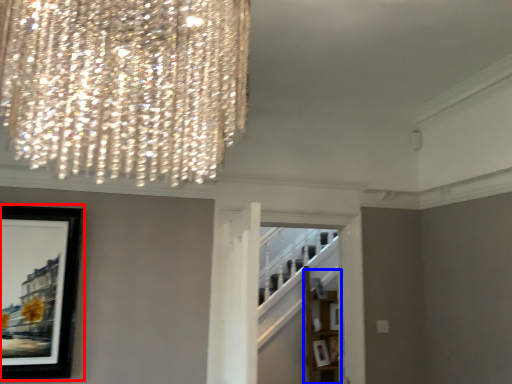
Question: Which object is further to the camera taking this photo, picture frame (highlighted by a red box) or shelf (highlighted by a blue box)?

Choices:
 (A) picture frame
 (B) shelf

Answer: (B)